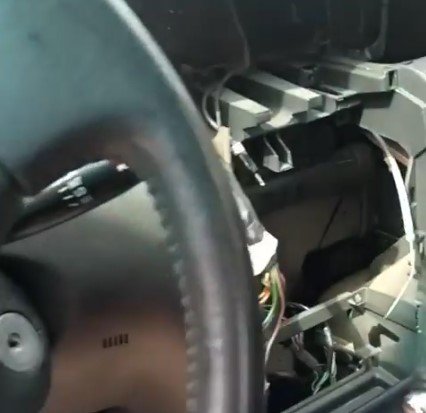
What are the coordinates of `interior` in the screenshot? It's located at (288, 200).